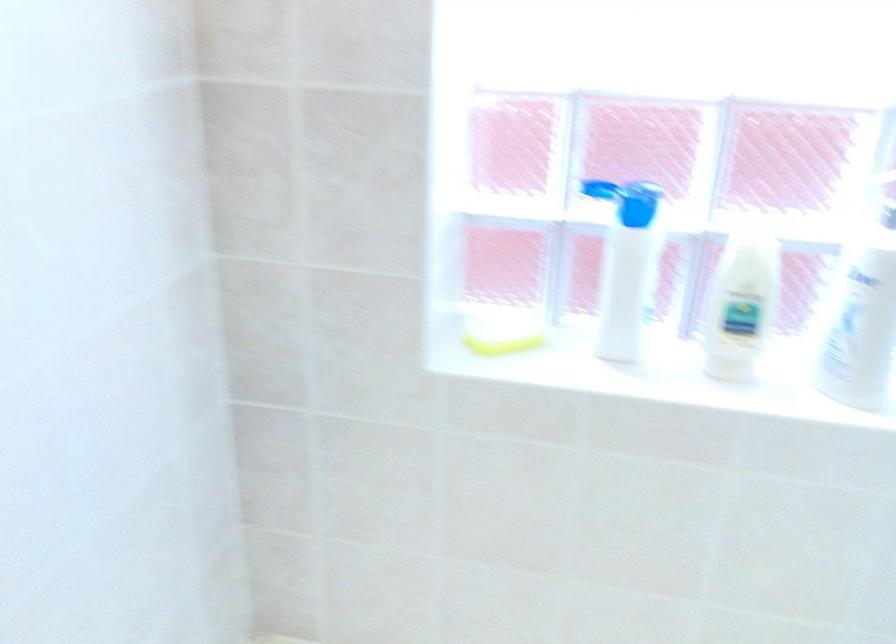
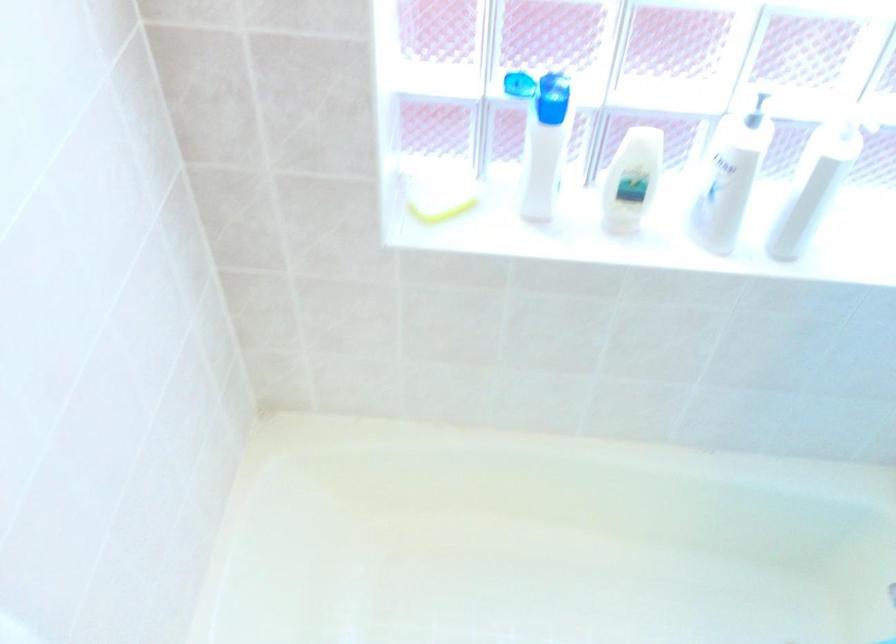
Question: Which direction would the cameraman need to move to produce the second image? Reply with the corresponding letter.

Choices:
 (A) Left
 (B) Right
 (C) Forward
 (D) Backward

Answer: (D)